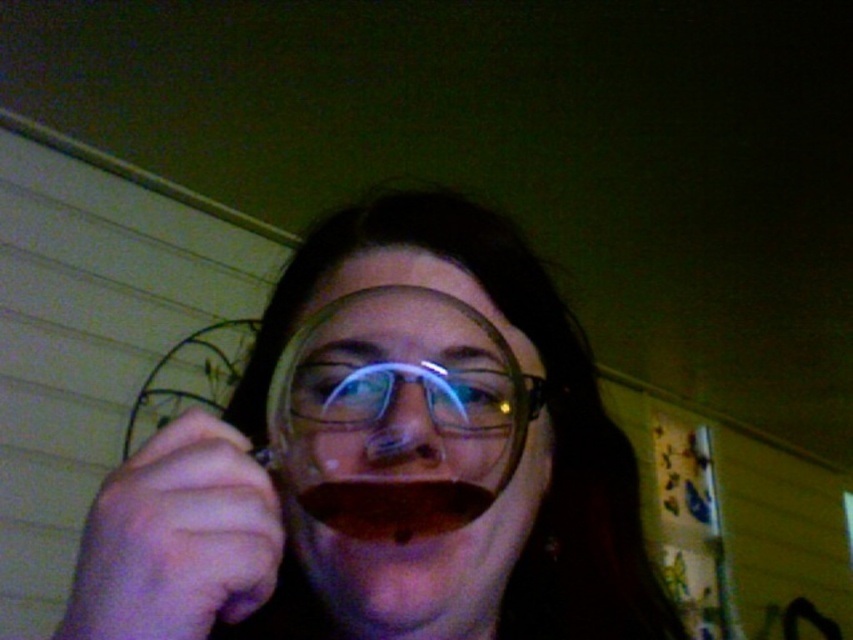
You are trying to pour a drink into the matte plastic cup at center and the clear plastic glasses at center. Which container can hold more liquid without spilling?

The matte plastic cup at center can hold more liquid without spilling because it might be wider than the clear plastic glasses at center.

You are a delivery person who needs to place a matte plastic cup at center on a shelf that is 10 inches away from you. Can you reach the shelf to place the cup without moving closer?

The matte plastic cup at center is 9.07 inches from the camera, so yes, you can reach the shelf to place the cup without moving closer since the distance is within the required 10 inches.